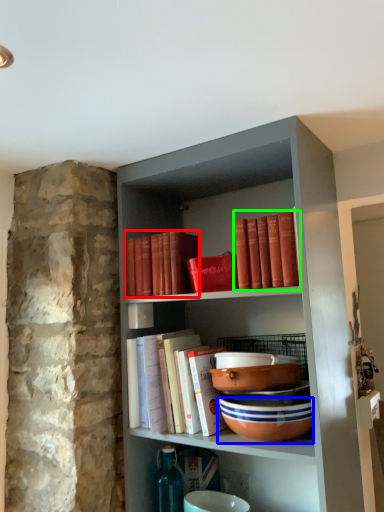
Question: Which object is the farthest from book (highlighted by a red box)? Choose among these: bowl (highlighted by a blue box) or book (highlighted by a green box).

Choices:
 (A) bowl
 (B) book

Answer: (A)